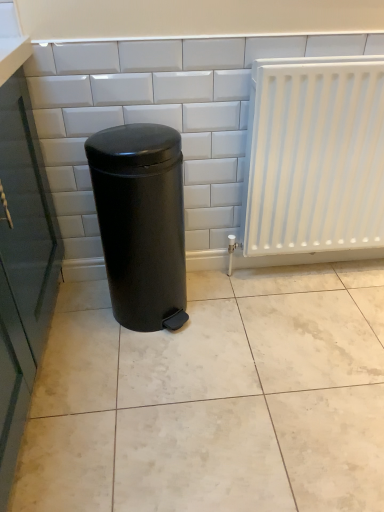
Image resolution: width=384 pixels, height=512 pixels. I want to click on empty space that is to the right of black matte waste container at center, so click(x=231, y=313).